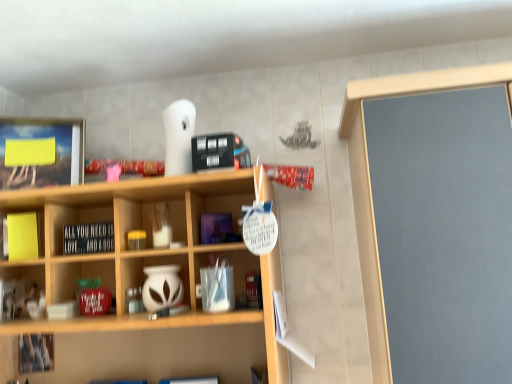
Question: In terms of width, does yellow matte sticky notes at left, the second cabinet positioned from the bottom, look wider or thinner when compared to black matte signboard at center?

Choices:
 (A) wide
 (B) thin

Answer: (B)

Question: Considering the positions of point (5, 230) and point (66, 236), is point (5, 230) closer or farther from the camera than point (66, 236)?

Choices:
 (A) closer
 (B) farther

Answer: (B)

Question: Based on their relative distances, which object is farther from the black matte signboard at center?

Choices:
 (A) white matte vase at center, which is the 1th cabinet in bottom-to-top order
 (B) yellow matte sticky notes at left, the second cabinet positioned from the bottom

Answer: (B)

Question: Which object is the closest to the white matte vase at center, which is the second cabinet in top-to-bottom order?

Choices:
 (A) black matte signboard at center
 (B) yellow matte sticky notes at left, placed as the second cabinet when sorted from right to left

Answer: (A)